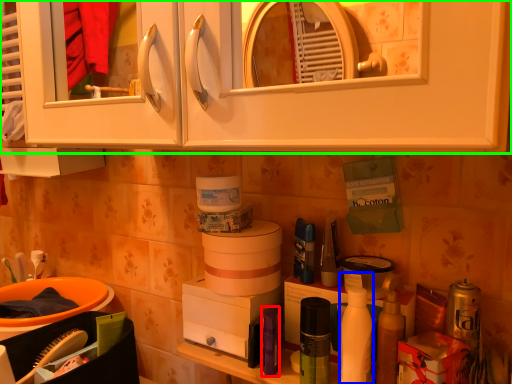
Question: Based on their relative distances, which object is nearer to toiletry (highlighted by a red box)? Choose from cleaning product (highlighted by a blue box) and cabinetry (highlighted by a green box).

Choices:
 (A) cleaning product
 (B) cabinetry

Answer: (A)